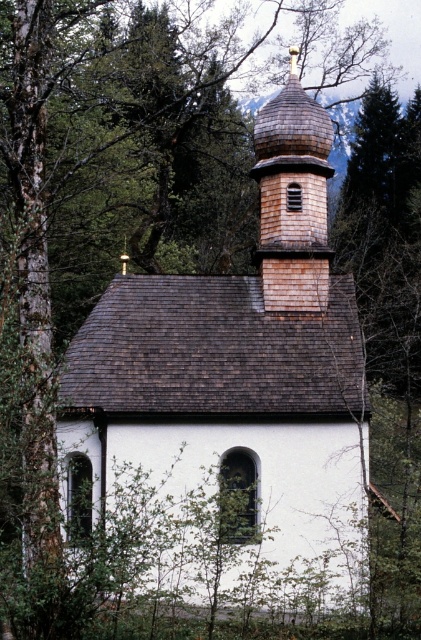
Question: Is white wood church at center positioned behind shiny brown shingles at upper center?

Choices:
 (A) no
 (B) yes

Answer: (A)

Question: Is white wood church at center further to the viewer compared to shiny brown shingles at upper center?

Choices:
 (A) yes
 (B) no

Answer: (B)

Question: Is white wood church at center further to the viewer compared to shiny brown shingles at upper center?

Choices:
 (A) yes
 (B) no

Answer: (B)

Question: Which object is farther from the camera taking this photo?

Choices:
 (A) shiny brown shingles at upper center
 (B) white wood church at center

Answer: (A)

Question: Which of the following is the farthest from the observer?

Choices:
 (A) (306, 118)
 (B) (266, 108)

Answer: (B)